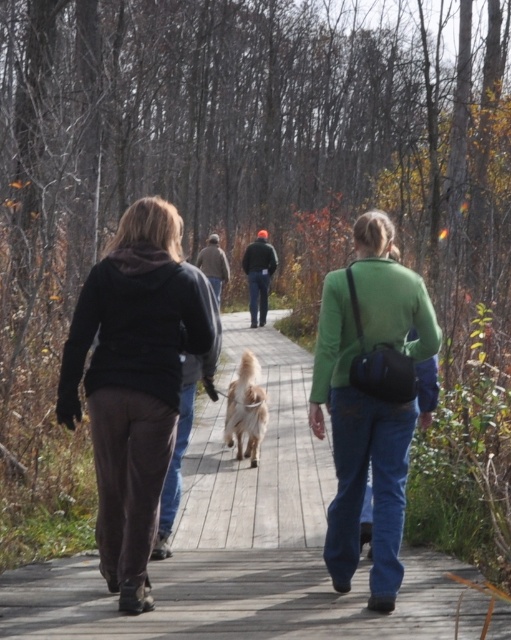
Question: Considering the real-world distances, which object is closest to the golden fur dog at center?

Choices:
 (A) wooden boardwalk at center
 (B) matte black hoodie at center

Answer: (A)

Question: Does wooden boardwalk at center appear on the right side of green matte jacket at center?

Choices:
 (A) no
 (B) yes

Answer: (A)

Question: Among these points, which one is nearest to the camera?

Choices:
 (A) (386, 273)
 (B) (258, 401)
 (C) (83, 634)

Answer: (C)

Question: Is matte black hoodie at center above golden fur dog at center?

Choices:
 (A) no
 (B) yes

Answer: (B)

Question: Does wooden boardwalk at center have a lesser width compared to green matte jacket at center?

Choices:
 (A) no
 (B) yes

Answer: (A)

Question: Among these points, which one is farthest from the camera?

Choices:
 (A) (394, 525)
 (B) (48, 628)

Answer: (A)